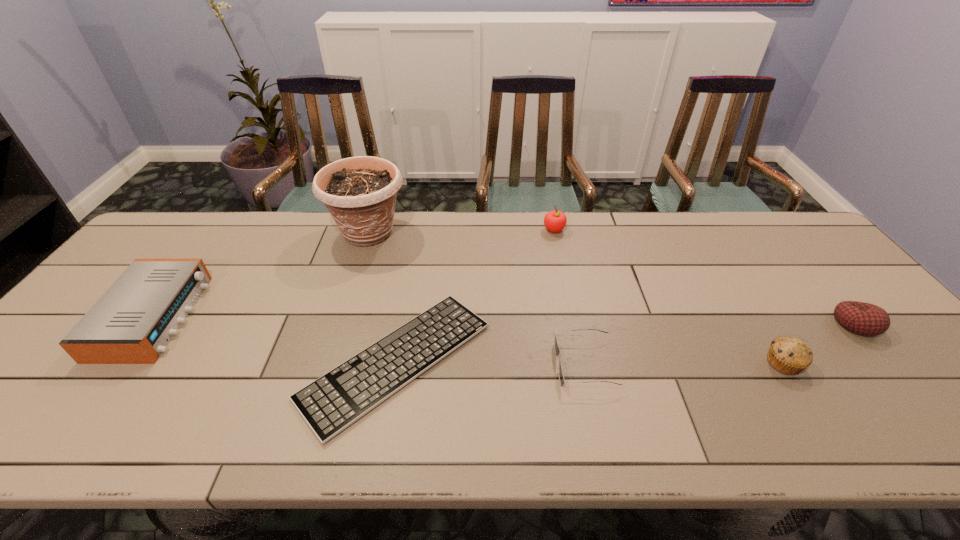
This screenshot has height=540, width=960. Identify the location of vacant area between the shortest object and the leftmost object. (276, 339).

Locate an element on the screen. The image size is (960, 540). empty location between the sixth object from left to right and the sunglasses is located at coordinates (684, 363).

You are a GUI agent. You are given a task and a screenshot of the screen. Output one action in this format:
    pyautogui.click(x=<x>, y=<y>)
    Task: Click on the vacant space that's between the radio receiver and the sunglasses
    The image size is (960, 540).
    Given the screenshot: What is the action you would take?
    pyautogui.click(x=370, y=341)

The width and height of the screenshot is (960, 540). In order to click on free space that is in between the rightmost object and the radio receiver in this screenshot , I will do `click(505, 320)`.

Identify which object is located as the fifth nearest to the muffin. Please provide its 2D coordinates. Your answer should be formatted as a tuple, i.e. [(x, y)], where the tuple contains the x and y coordinates of a point satisfying the conditions above.

[(360, 192)]

Identify the location of the sixth closest object to the radio receiver. (861, 318).

Locate an element on the screen. The width and height of the screenshot is (960, 540). vacant space that satisfies the following two spatial constraints: 1. on the control panel of the beanbag; 2. on the left side of the leftmost object is located at coordinates (150, 324).

Find the location of `blank area in the image that satisfies the following two spatial constraints: 1. on the control panel of the radio receiver; 2. on the left side of the computer keyboard`. blank area in the image that satisfies the following two spatial constraints: 1. on the control panel of the radio receiver; 2. on the left side of the computer keyboard is located at coordinates (122, 361).

This screenshot has height=540, width=960. Identify the location of free space that satisfies the following two spatial constraints: 1. on the control panel of the muffin; 2. on the left side of the leftmost object. (120, 363).